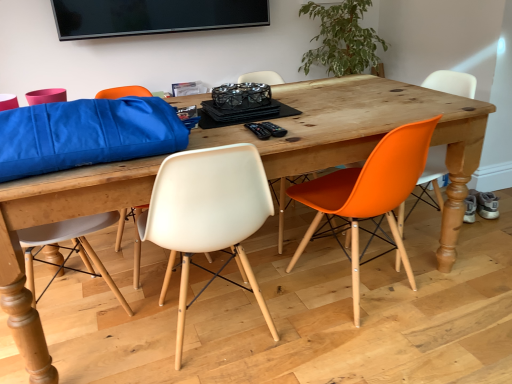
Question: In which direction should I rotate to look at black plastic remote control at center, which is the 2th remote control in right-to-left order?

Choices:
 (A) right
 (B) left

Answer: (A)

Question: Is black plastic remote control at center, which is the second remote control from left to right, positioned with its back to orange plastic chair at right, the 1th chair positioned from the right?

Choices:
 (A) yes
 (B) no

Answer: (B)

Question: Is black plastic remote control at center, which is the second remote control from left to right, in front of orange plastic chair at right, the 1th chair positioned from the right?

Choices:
 (A) yes
 (B) no

Answer: (A)

Question: From the image's perspective, is black plastic remote control at center, which is the second remote control from left to right, above orange plastic chair at right, the third chair positioned from the left?

Choices:
 (A) no
 (B) yes

Answer: (B)

Question: Can you confirm if black plastic remote control at center, the 1th remote control viewed from the right, is thinner than orange plastic chair at right, the third chair positioned from the left?

Choices:
 (A) no
 (B) yes

Answer: (B)

Question: From the image's perspective, does black plastic remote control at center, which is the second remote control from left to right, appear lower than orange plastic chair at right, the 1th chair positioned from the right?

Choices:
 (A) no
 (B) yes

Answer: (A)

Question: Is black plastic remote control at center, which is the second remote control from left to right, shorter than orange plastic chair at right, the third chair positioned from the left?

Choices:
 (A) yes
 (B) no

Answer: (A)

Question: Can you confirm if orange matte plastic chair at right, which appears as the 2th chair when viewed from the right, is positioned to the right of black plastic remote control at center, which is the 2th remote control in right-to-left order?

Choices:
 (A) no
 (B) yes

Answer: (B)

Question: Is orange matte plastic chair at right, which appears as the 2th chair when viewed from the right, at the left side of black plastic remote control at center, which is counted as the first remote control, starting from the left?

Choices:
 (A) yes
 (B) no

Answer: (B)

Question: Is orange matte plastic chair at right, which appears as the 2th chair when viewed from the right, further to camera compared to black plastic remote control at center, which is the 2th remote control in right-to-left order?

Choices:
 (A) yes
 (B) no

Answer: (B)

Question: Is orange matte plastic chair at right, which is counted as the second chair, starting from the left, next to black plastic remote control at center, which is counted as the first remote control, starting from the left, and touching it?

Choices:
 (A) yes
 (B) no

Answer: (B)

Question: Does orange matte plastic chair at right, which appears as the 2th chair when viewed from the right, have a lesser width compared to black plastic remote control at center, which is the 2th remote control in right-to-left order?

Choices:
 (A) no
 (B) yes

Answer: (A)

Question: From a real-world perspective, is orange matte plastic chair at right, which appears as the 2th chair when viewed from the right, beneath black plastic remote control at center, which is counted as the first remote control, starting from the left?

Choices:
 (A) yes
 (B) no

Answer: (A)

Question: Considering the relative positions of black plastic remote control at center, which is the second remote control from left to right, and orange matte plastic chair at right, which appears as the 2th chair when viewed from the right, in the image provided, is black plastic remote control at center, which is the second remote control from left to right, to the left of orange matte plastic chair at right, which appears as the 2th chair when viewed from the right, from the viewer's perspective?

Choices:
 (A) yes
 (B) no

Answer: (A)